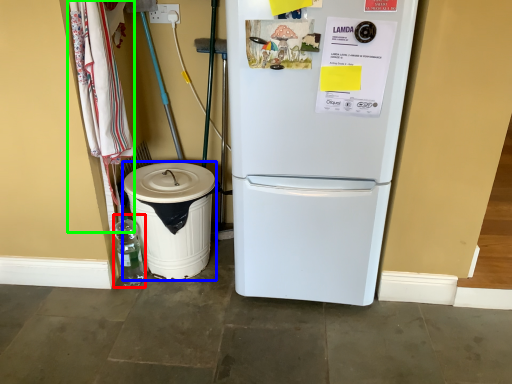
Question: Which is nearer to the bottle (highlighted by a red box)? trash bin/can (highlighted by a blue box) or laundry (highlighted by a green box).

Choices:
 (A) trash bin/can
 (B) laundry

Answer: (A)